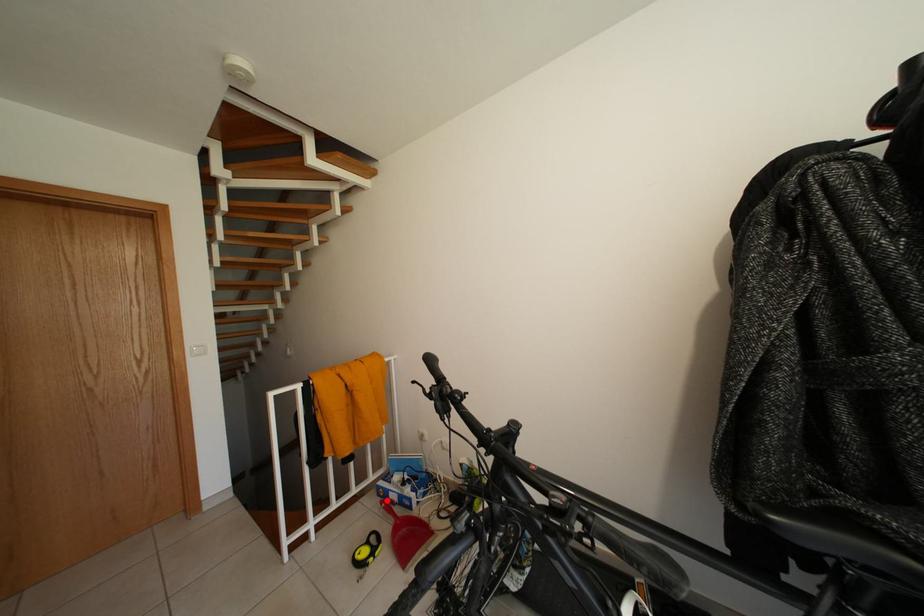
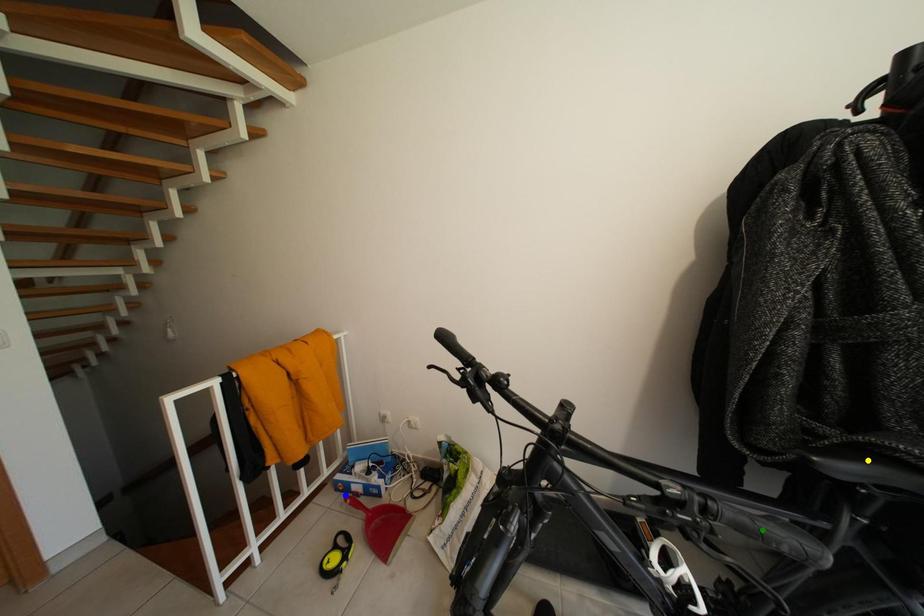
Question: I am providing you with two images of the same scene from different viewpoints. A red point is marked on the first image. You are given multiple points on the second image. Can you choose the point in image 2 that corresponds to the point in image 1?

Choices:
 (A) green point
 (B) yellow point
 (C) blue point

Answer: (C)